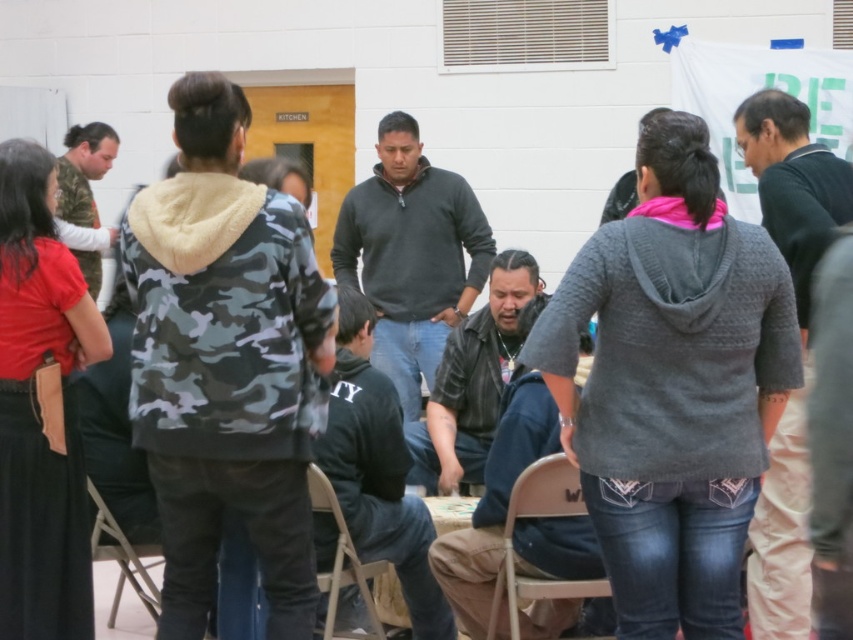
You are organizing a photo shoot and need to ensure that two models wearing the camo fleece jacket at center and the red cotton shirt at left can sit side by side on a bench that is 1.2 meters wide. Based on their clothing widths, will they fit comfortably?

The camo fleece jacket at center might be wider than red cotton shirt at left. However, without exact measurements, it is uncertain if their combined widths will fit within the 1.2 meter bench. Consider checking the actual dimensions or allowing extra space for comfort.

You are standing at the entrance of the community center and notice a knit gray sweater at center. If you want to pick it up, which direction should you move relative to your current position?

The knit gray sweater at center is located at point 0.603 on the x and 0.789 on the y axis. Since you are at the entrance, you should move towards the center of the room to reach it.